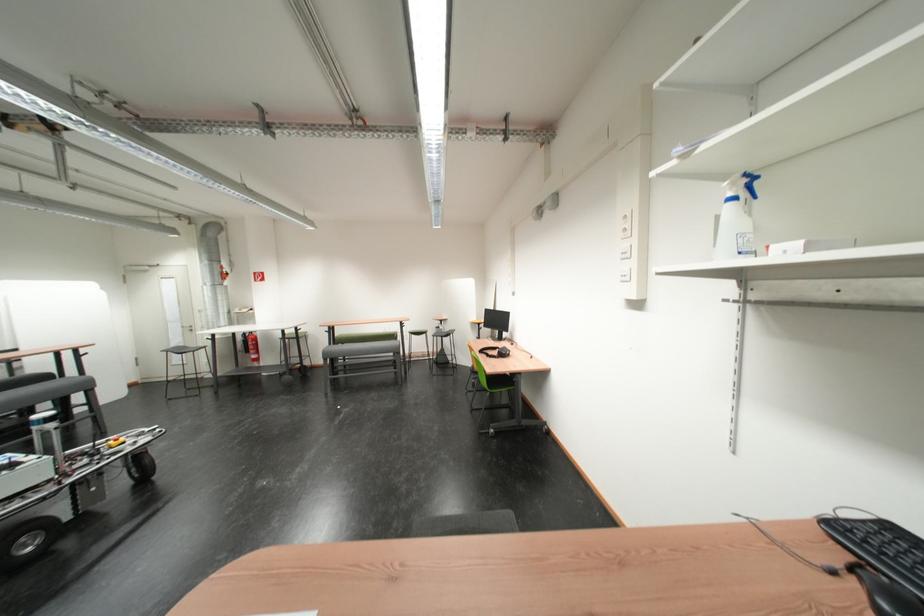
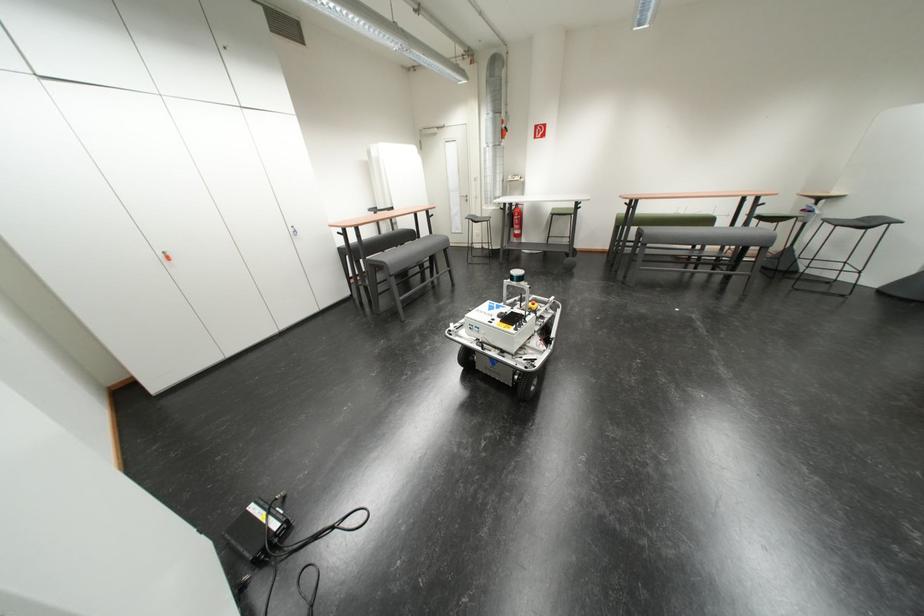
In the second image, find the point that corresponds to [54,382] in the first image.

(423, 237)